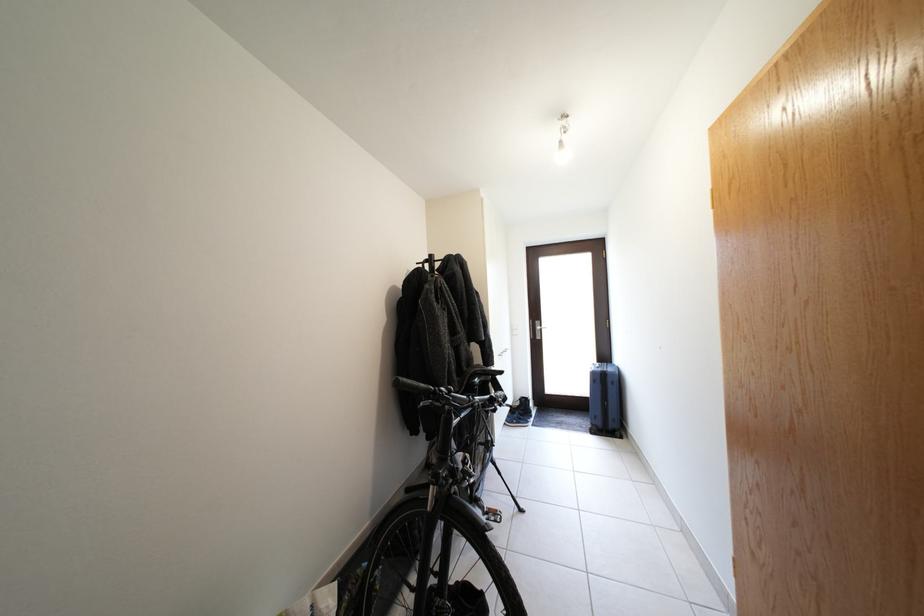
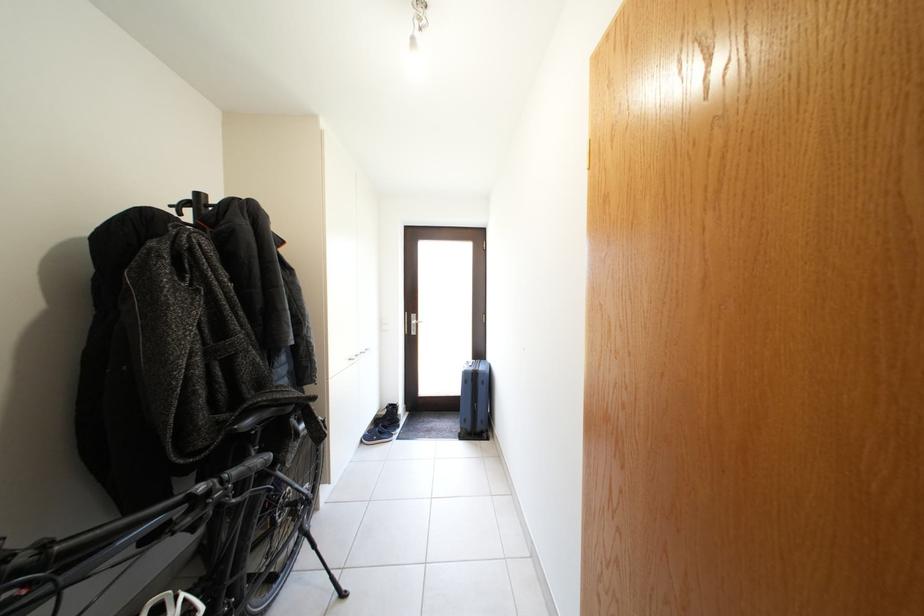
Which direction would the cameraman need to move to produce the second image?

The movement direction of the cameraman is right, forward.